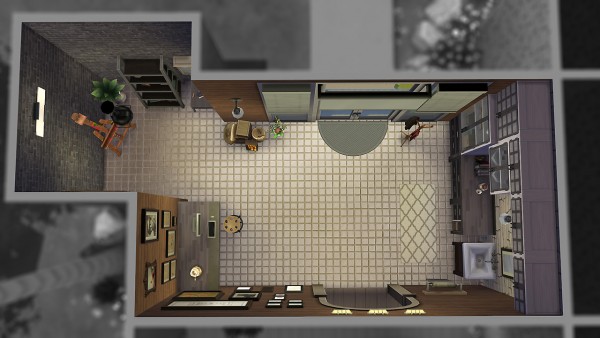
Identify the location of doorway. (362, 112).